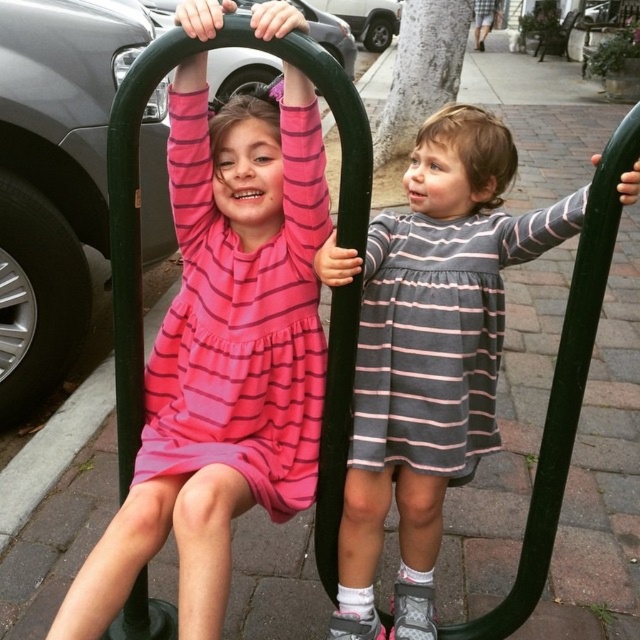
Looking at this image, between pink striped dress at upper left and gray striped dress at center, which one is positioned higher?

pink striped dress at upper left is above.

Does pink striped dress at upper left appear on the left side of gray striped dress at center?

Correct, you'll find pink striped dress at upper left to the left of gray striped dress at center.

Between point (140, 461) and point (449, 253), which one is positioned behind?

Point (449, 253)

Identify the location of pink striped dress at upper left. The width and height of the screenshot is (640, 640). (221, 356).